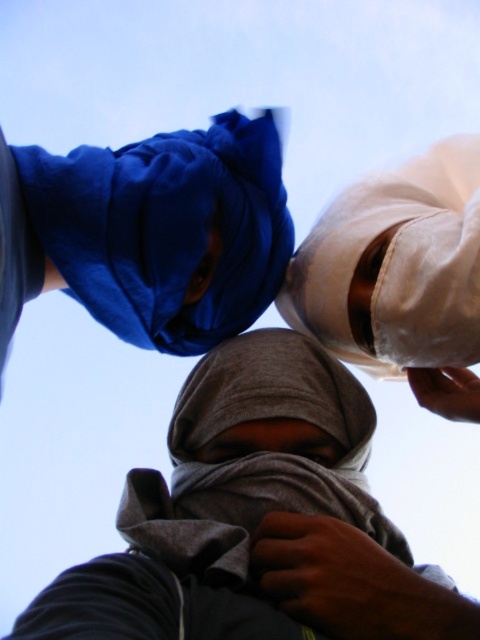
Who is more distant from viewer, (205, 337) or (319, 486)?

The point (205, 337) is more distant.

Can you confirm if blue fabric headscarf at upper center is positioned to the right of gray fabric headscarf at center?

Incorrect, blue fabric headscarf at upper center is not on the right side of gray fabric headscarf at center.

Between point (203, 307) and point (251, 468), which one is positioned in front?

Positioned in front is point (251, 468).

You are a GUI agent. You are given a task and a screenshot of the screen. Output one action in this format:
    pyautogui.click(x=<x>, y=<y>)
    Task: Click on the blue fabric headscarf at upper center
    
    Given the screenshot: What is the action you would take?
    pyautogui.click(x=166, y=228)